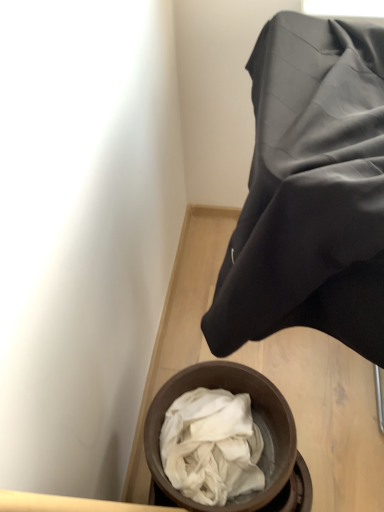
Find the location of a particular element. free space above matte black fabric at upper right (from a real-world perspective) is located at coordinates (313, 94).